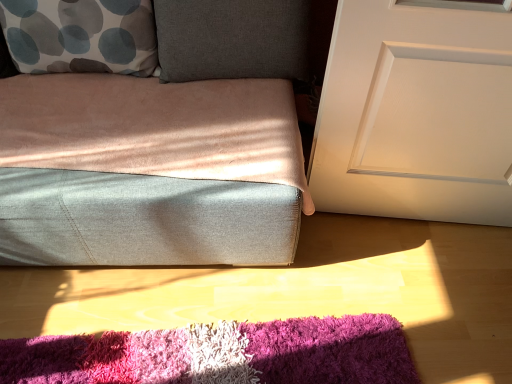
Where is `blank space above shaggy multicolor rug at lower center (from a real-world perspective)`? This screenshot has height=384, width=512. blank space above shaggy multicolor rug at lower center (from a real-world perspective) is located at coordinates (220, 355).